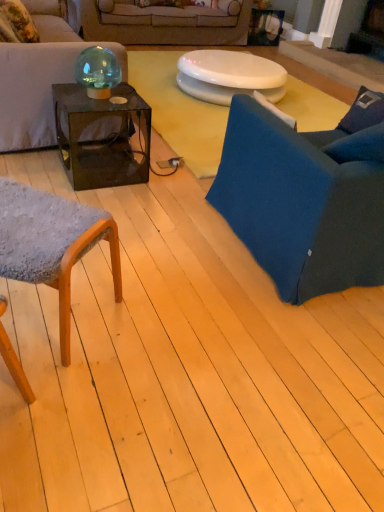
Identify the location of unoccupied region to the right of textured gray fabric chair at lower left, which is the 1th chair from left to right. This screenshot has width=384, height=512. (156, 326).